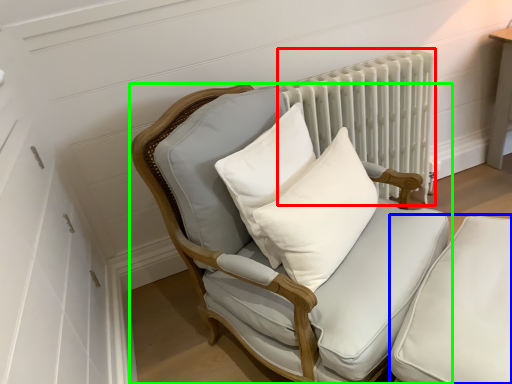
Question: Which is nearer to the radiator (highlighted by a red box)? swivel chair (highlighted by a blue box) or chair (highlighted by a green box).

Choices:
 (A) swivel chair
 (B) chair

Answer: (B)